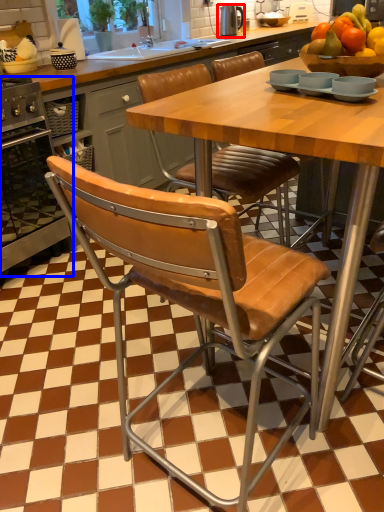
Question: Which object is closer to the camera taking this photo, appliance (highlighted by a red box) or oven (highlighted by a blue box)?

Choices:
 (A) appliance
 (B) oven

Answer: (B)